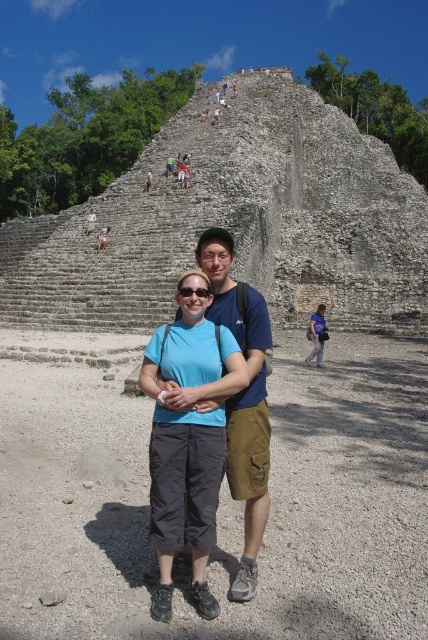
You are a photographer who wants to capture the blue cotton shirt at center in your shot. What are the coordinates where you should focus your camera?

The blue cotton shirt at center is located at coordinates point (243, 397).